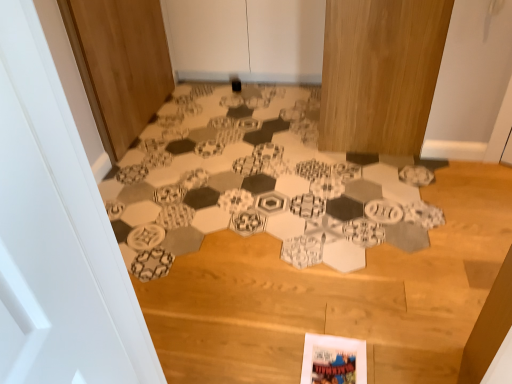
Question: From a real-world perspective, is white matte door at center, the 1th door from the right, positioned under white paper at center based on gravity?

Choices:
 (A) yes
 (B) no

Answer: (B)

Question: Is white matte door at center, which is counted as the second door, starting from the left, at the left side of white paper at center?

Choices:
 (A) no
 (B) yes

Answer: (B)

Question: Can we say white matte door at center, which is counted as the second door, starting from the left, lies outside white paper at center?

Choices:
 (A) yes
 (B) no

Answer: (A)

Question: Is white matte door at center, which is counted as the second door, starting from the left, positioned behind white paper at center?

Choices:
 (A) no
 (B) yes

Answer: (B)

Question: Does white matte door at center, the 1th door from the right, have a greater height compared to white paper at center?

Choices:
 (A) no
 (B) yes

Answer: (B)

Question: Can you confirm if white matte door at center, which is counted as the second door, starting from the left, is positioned to the right of white paper at center?

Choices:
 (A) yes
 (B) no

Answer: (B)

Question: Is wooden door at left, marked as the 2th door in a right-to-left arrangement, not near white paper at center?

Choices:
 (A) yes
 (B) no

Answer: (B)

Question: Does wooden door at left, marked as the 2th door in a right-to-left arrangement, have a lesser width compared to white paper at center?

Choices:
 (A) yes
 (B) no

Answer: (A)

Question: From the image's perspective, does wooden door at left, marked as the 2th door in a right-to-left arrangement, appear higher than white paper at center?

Choices:
 (A) yes
 (B) no

Answer: (A)

Question: From a real-world perspective, is wooden door at left, marked as the 2th door in a right-to-left arrangement, located higher than white paper at center?

Choices:
 (A) yes
 (B) no

Answer: (A)

Question: Is wooden door at left, marked as the 2th door in a right-to-left arrangement, shorter than white paper at center?

Choices:
 (A) yes
 (B) no

Answer: (B)

Question: Does wooden door at left, the first door viewed from the left, come in front of white paper at center?

Choices:
 (A) yes
 (B) no

Answer: (B)

Question: Can you confirm if wooden door at left, marked as the 2th door in a right-to-left arrangement, is wider than white matte door at center, the 1th door from the right?

Choices:
 (A) no
 (B) yes

Answer: (A)